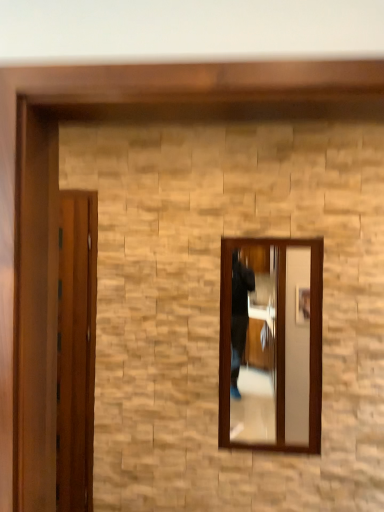
What is the approximate height of wooden door at left?

6.20 feet.

What do you see at coordinates (76, 349) in the screenshot? The width and height of the screenshot is (384, 512). I see `wooden door at left` at bounding box center [76, 349].

I want to click on wooden door at left, so click(76, 349).

Find the location of a particular element. clear glass mirror at center is located at coordinates (276, 354).

What do you see at coordinates (276, 354) in the screenshot?
I see `clear glass mirror at center` at bounding box center [276, 354].

The width and height of the screenshot is (384, 512). What are the coordinates of `wooden door at left` in the screenshot? It's located at (76, 349).

Which object is positioned more to the right, clear glass mirror at center or wooden door at left?

clear glass mirror at center.

In the scene shown: Is clear glass mirror at center positioned before wooden door at left?

Yes, clear glass mirror at center is in front of wooden door at left.

Is point (281, 264) behind point (76, 434)?

No, (281, 264) is closer to viewer.

From the image's perspective, would you say clear glass mirror at center is shown under wooden door at left?

No, from the image's perspective, clear glass mirror at center is not beneath wooden door at left.

From a real-world perspective, does clear glass mirror at center stand above wooden door at left?

Yes, from a real-world perspective, clear glass mirror at center is on top of wooden door at left.

Considering the sizes of clear glass mirror at center and wooden door at left in the image, is clear glass mirror at center wider or thinner than wooden door at left?

Clearly, clear glass mirror at center has more width compared to wooden door at left.

Is clear glass mirror at center taller than wooden door at left?

Incorrect, the height of clear glass mirror at center is not larger of that of wooden door at left.

Which of these two, clear glass mirror at center or wooden door at left, is smaller?

With smaller size is wooden door at left.

Could wooden door at left be considered to be inside clear glass mirror at center?

No, wooden door at left is not a part of clear glass mirror at center.

Is clear glass mirror at center not close to wooden door at left?

Yes, clear glass mirror at center and wooden door at left are quite far apart.

Is clear glass mirror at center oriented away from wooden door at left?

clear glass mirror at center is not turned away from wooden door at left.

Consider the image. How different are the orientations of clear glass mirror at center and wooden door at left in degrees?

0.00641 degrees.

The height and width of the screenshot is (512, 384). What are the coordinates of `door on the left of clear glass mirror at center` in the screenshot? It's located at (76, 349).

Does wooden door at left appear on the left side of clear glass mirror at center?

Yes.

Which object is closer to the camera, wooden door at left or clear glass mirror at center?

clear glass mirror at center is in front.

Which is closer to the camera, (74, 284) or (259, 339)?

The point (74, 284) is closer.

From the image's perspective, between wooden door at left and clear glass mirror at center, who is located below?

wooden door at left appears lower in the image.

From a real-world perspective, relative to clear glass mirror at center, is wooden door at left vertically above or below?

wooden door at left is below clear glass mirror at center.

Considering the sizes of objects wooden door at left and clear glass mirror at center in the image provided, who is thinner, wooden door at left or clear glass mirror at center?

wooden door at left.

Is wooden door at left taller than clear glass mirror at center?

Correct, wooden door at left is much taller as clear glass mirror at center.

Considering the sizes of objects wooden door at left and clear glass mirror at center in the image provided, who is bigger, wooden door at left or clear glass mirror at center?

With larger size is clear glass mirror at center.

Which is correct: wooden door at left is inside clear glass mirror at center, or outside of it?

wooden door at left lies outside clear glass mirror at center.

Is wooden door at left next to clear glass mirror at center?

There is a gap between wooden door at left and clear glass mirror at center.

Does wooden door at left turn towards clear glass mirror at center?

No, wooden door at left is not facing towards clear glass mirror at center.

Can you tell me how much wooden door at left and clear glass mirror at center differ in facing direction?

The facing directions of wooden door at left and clear glass mirror at center are 0.00641 degrees apart.

Identify the location of mirror above the wooden door at left (from the image's perspective). This screenshot has height=512, width=384. (276, 354).

Where is `door behind the clear glass mirror at center`? door behind the clear glass mirror at center is located at coordinates (76, 349).

At what (x,y) coordinates should I click in order to perform the action: click on door on the left side of clear glass mirror at center. Please return your answer as a coordinate pair (x, y). Looking at the image, I should click on (76, 349).